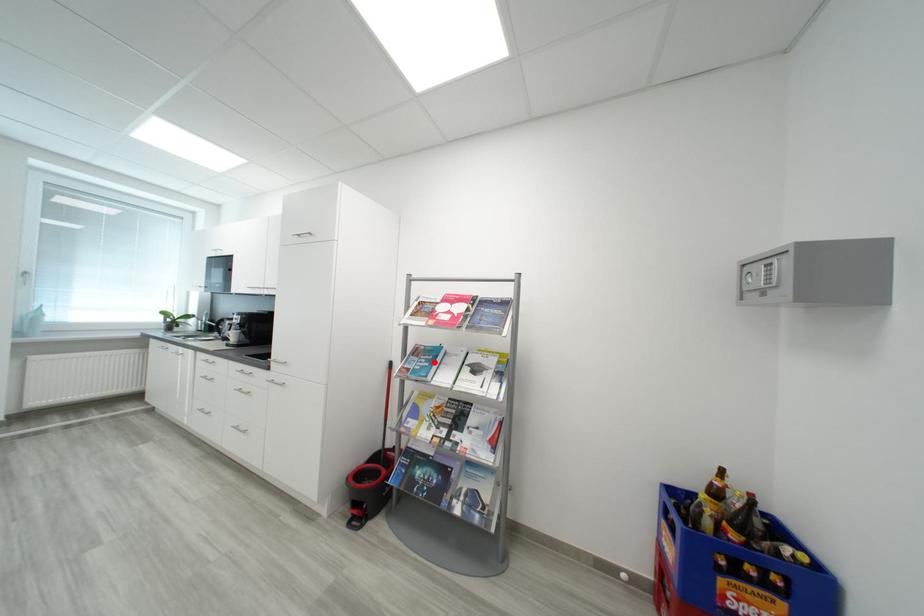
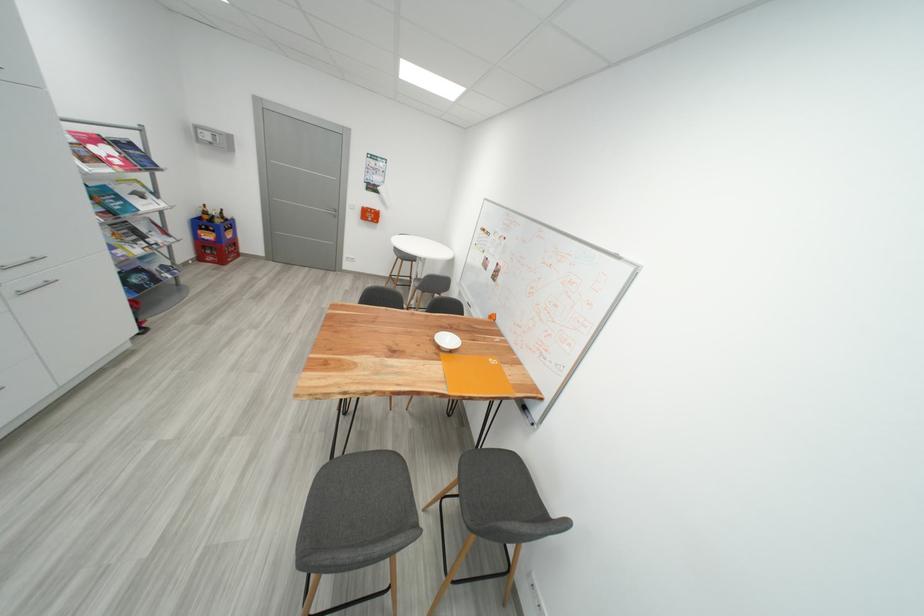
Question: I am providing you with two images of the same scene from different viewpoints. Given a red point in image1, look at the same physical point in image2. Is it:

Choices:
 (A) Closer to the viewpoint
 (B) Farther from the viewpoint

Answer: (B)